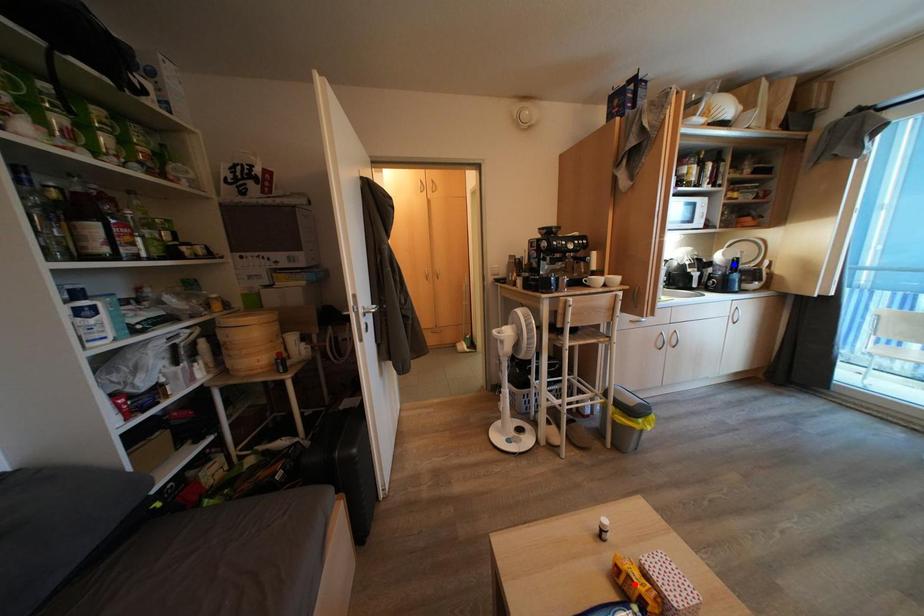
Question: Which of the two points in the image is closer to the camera?

Choices:
 (A) Blue point is closer.
 (B) Red point is closer.

Answer: (B)